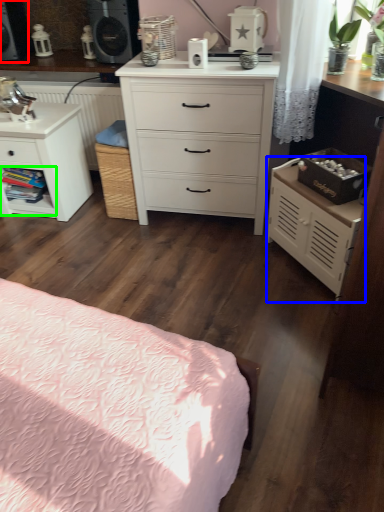
Question: Based on their relative distances, which object is nearer to speaker (highlighted by a red box)? Choose from nightstand (highlighted by a blue box) and shelf (highlighted by a green box).

Choices:
 (A) nightstand
 (B) shelf

Answer: (B)